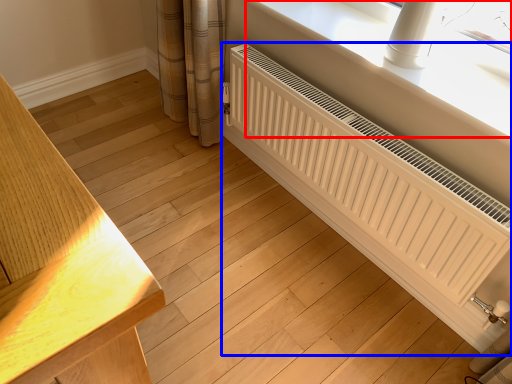
Question: Among these objects, which one is nearest to the camera, window sill (highlighted by a red box) or radiator (highlighted by a blue box)?

Choices:
 (A) window sill
 (B) radiator

Answer: (B)